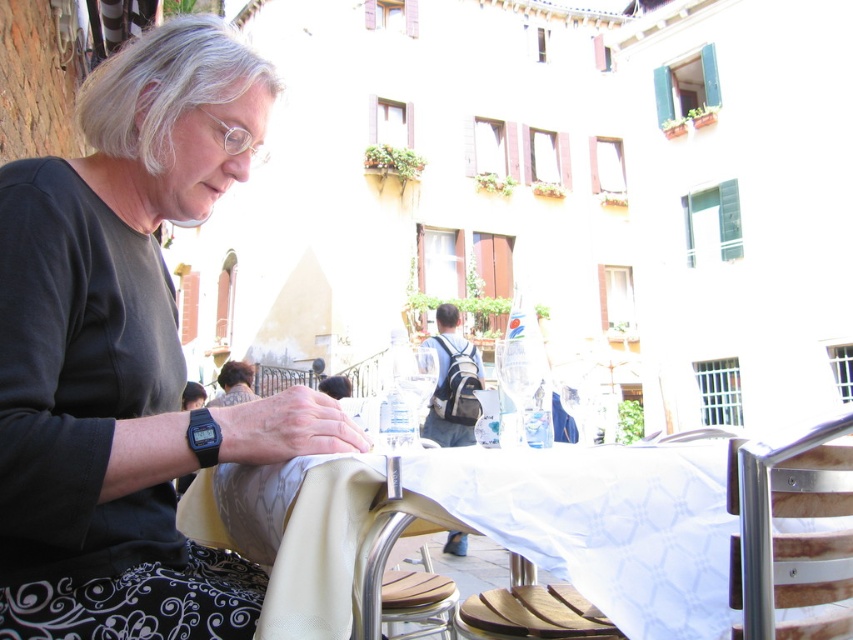
Question: Which is nearer to the white fabric table at center?

Choices:
 (A) gray matte hair at upper left
 (B) matte black shirt at center

Answer: (B)

Question: Among these points, which one is nearest to the camera?

Choices:
 (A) (253, 80)
 (B) (126, 298)
 (C) (367, 554)

Answer: (C)

Question: Does matte black shirt at center have a greater width compared to white fabric table at center?

Choices:
 (A) no
 (B) yes

Answer: (A)

Question: Can you confirm if white fabric table at center is bigger than dark brown hair at center?

Choices:
 (A) yes
 (B) no

Answer: (B)

Question: Which object appears farthest from the camera in this image?

Choices:
 (A) dark brown hair at center
 (B) white fabric table at center

Answer: (A)

Question: Where is white fabric table at center located in relation to dark brown hair at center in the image?

Choices:
 (A) above
 (B) below

Answer: (B)